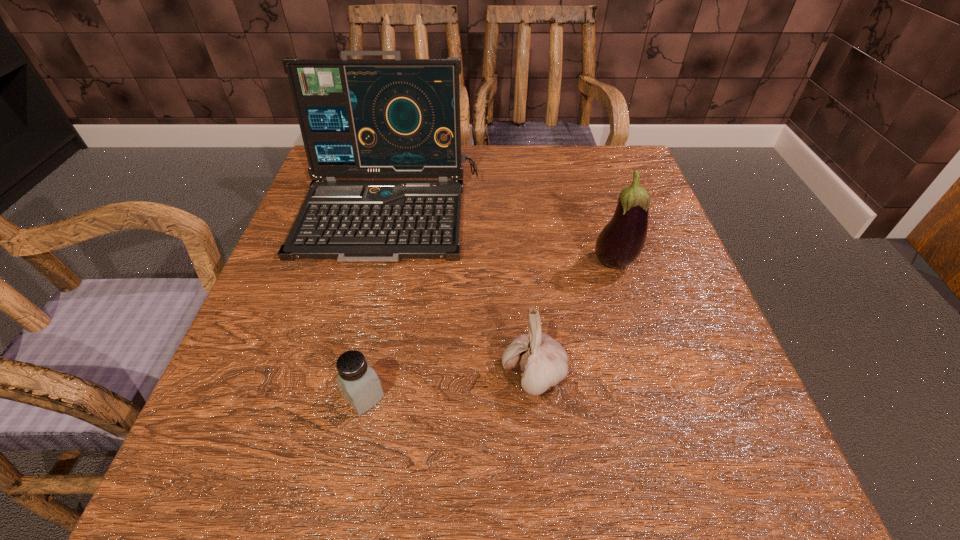
In order to click on object present at the far edge in this screenshot , I will do `click(359, 118)`.

Where is `object that is at the left edge`? The width and height of the screenshot is (960, 540). object that is at the left edge is located at coordinates (359, 118).

At what (x,y) coordinates should I click in order to perform the action: click on object that is at the right edge. Please return your answer as a coordinate pair (x, y). The height and width of the screenshot is (540, 960). Looking at the image, I should click on (621, 241).

Where is `object that is positioned at the far left corner`? object that is positioned at the far left corner is located at coordinates (359, 118).

In the image, there is a desktop. At what (x,y) coordinates should I click in order to perform the action: click on vacant space at the far edge. Please return your answer as a coordinate pair (x, y). Looking at the image, I should click on (553, 154).

At what (x,y) coordinates should I click in order to perform the action: click on free space at the near edge of the desktop. Please return your answer as a coordinate pair (x, y). Looking at the image, I should click on (531, 455).

In the image, there is a desktop. Where is `free space at the left edge`? The image size is (960, 540). free space at the left edge is located at coordinates (310, 395).

The width and height of the screenshot is (960, 540). Identify the location of vacant area at the right edge. (686, 300).

At what (x,y) coordinates should I click in order to perform the action: click on vacant area at the near left corner. Please return your answer as a coordinate pair (x, y). Looking at the image, I should click on (228, 451).

In the image, there is a desktop. Where is `vacant space at the far right corner`? The image size is (960, 540). vacant space at the far right corner is located at coordinates (602, 151).